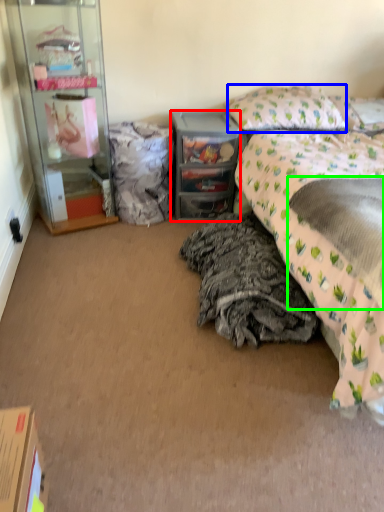
Question: Which is farther away from desk (highlighted by a red box)? pillow (highlighted by a blue box) or sheet (highlighted by a green box)?

Choices:
 (A) pillow
 (B) sheet

Answer: (B)